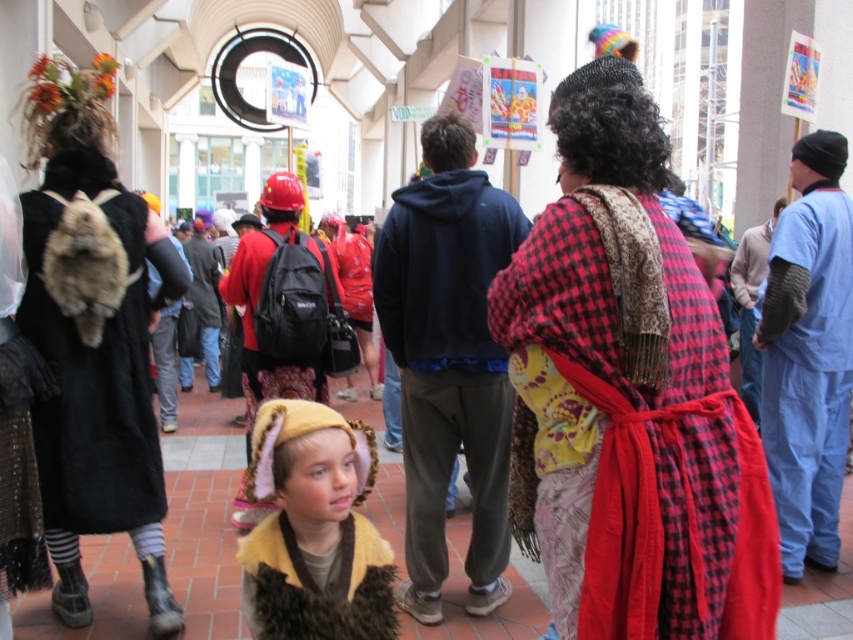
You are a photographer standing at the edge of the crowd, aiming to capture a photo that includes both the red plaid robe at center and the blue scrubs at right. Given that your camera has a focal length of 50mm and you want both subjects to be in focus, what should you consider about their distance apart?

The red plaid robe at center is 2.60 meters away from the blue scrubs at right. To ensure both are in focus, you should use a small aperture setting to increase depth of field, as the distance between them is 2.60 meters.

You are a photographer at the event and want to capture both the red plaid dress at center and the fuzzy yellow hat at center in the same frame. Since the dress is taller than the hat, where should you position your camera relative to the subjects to ensure both are fully visible?

To ensure both the red plaid dress at center and the fuzzy yellow hat at center are fully visible, position your camera slightly lower than the height of the red plaid dress at center. This way, the camera can capture the full height of the dress while still including the fuzzy yellow hat at center, which is shorter.